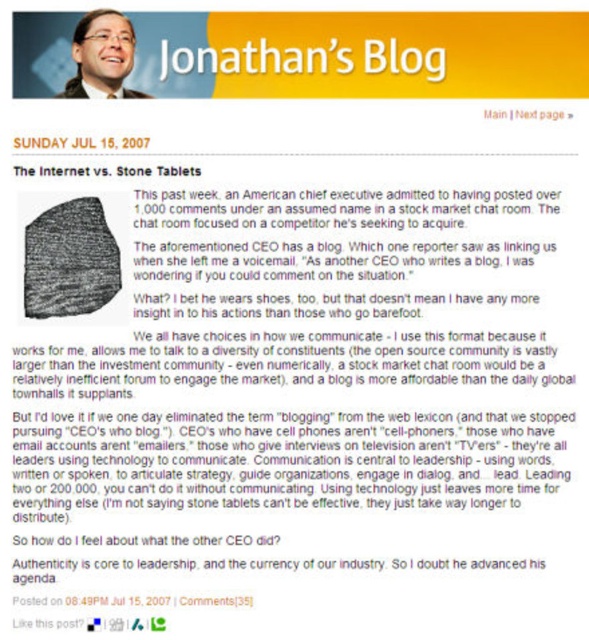
Which is below, matte black glasses at upper left or white text page at right?

white text page at right is below.

Who is positioned more to the right, matte black glasses at upper left or white text page at right?

Positioned to the right is white text page at right.

Find the location of a particular element. matte black glasses at upper left is located at coordinates (101, 56).

The image size is (589, 640). I want to click on matte black glasses at upper left, so click(101, 56).

Can you confirm if white paper at upper center is positioned to the left of matte black glasses at upper left?

No, white paper at upper center is not to the left of matte black glasses at upper left.

Between point (193, 60) and point (74, 52), which one is positioned behind?

Point (193, 60)

Locate an element on the screen. The image size is (589, 640). white paper at upper center is located at coordinates (309, 60).

Identify the location of white paper at upper center. (309, 60).

Does white paper at upper center have a greater width compared to black stone tablet at upper left?

Yes, white paper at upper center is wider than black stone tablet at upper left.

Which is behind, point (237, 54) or point (120, 173)?

The point (237, 54) is behind.

At what (x,y) coordinates should I click in order to perform the action: click on white paper at upper center. Please return your answer as a coordinate pair (x, y). Looking at the image, I should click on (309, 60).